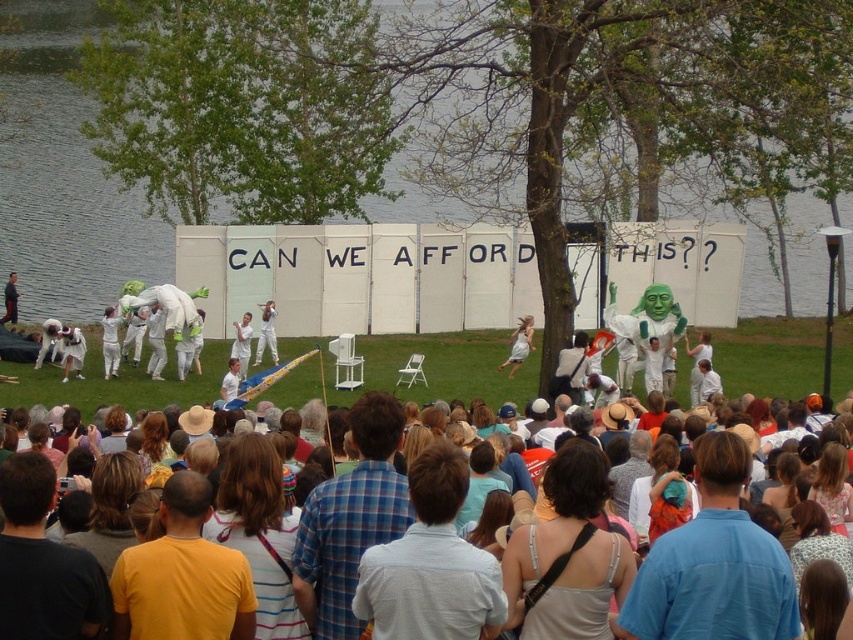
Question: Among these points, which one is farthest from the camera?

Choices:
 (A) (718, 616)
 (B) (428, 467)

Answer: (B)

Question: Considering the relative positions of silver metallic tank top at center and white cotton pants at center in the image provided, where is silver metallic tank top at center located with respect to white cotton pants at center?

Choices:
 (A) above
 (B) below

Answer: (B)

Question: Considering the real-world distances, which object is farthest from the white cotton pants at center?

Choices:
 (A) striped cotton shirt at center
 (B) light blue shirt at center
 (C) blue plaid shirt at center

Answer: (B)

Question: Observing the image, what is the correct spatial positioning of white matte water at center in reference to blue plaid shirt at center?

Choices:
 (A) right
 (B) left

Answer: (B)

Question: Can you confirm if blue cotton shirt at center is positioned below silver metallic tank top at center?

Choices:
 (A) no
 (B) yes

Answer: (B)

Question: Which object is closer to the camera taking this photo?

Choices:
 (A) striped cotton shirt at center
 (B) yellow t-shirt at lower left
 (C) white cotton dress at center
 (D) white matte water at center

Answer: (B)